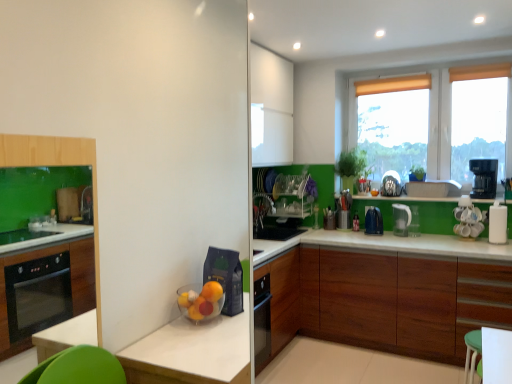
Identify the location of vacant point to the left of white glossy paper towel dispenser at right, the fourth appliance viewed from the back. pos(477,244).